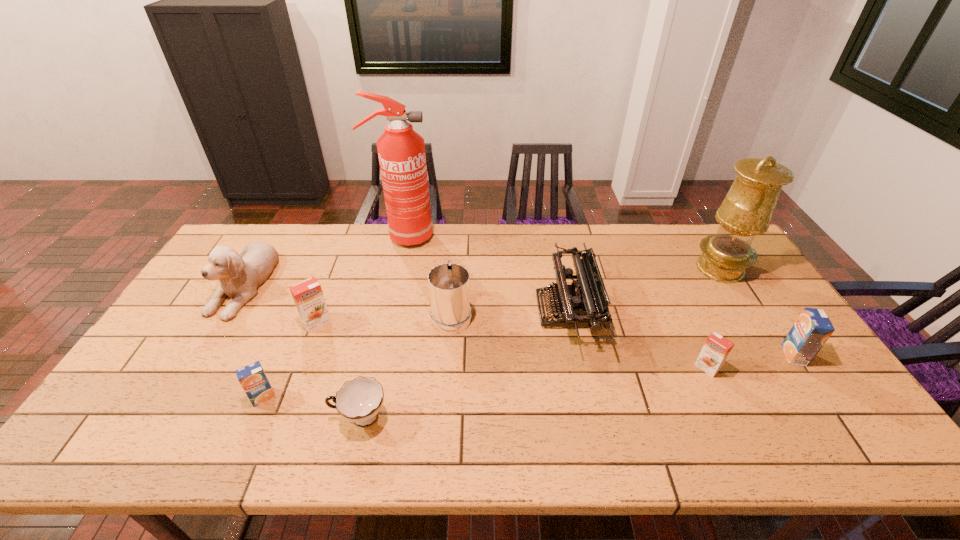
Locate an element on the screen. Image resolution: width=960 pixels, height=540 pixels. fire extinguisher is located at coordinates (401, 151).

Image resolution: width=960 pixels, height=540 pixels. I want to click on red fire extinguisher, so click(401, 151).

Where is `the ninth shortest object`? The width and height of the screenshot is (960, 540). the ninth shortest object is located at coordinates (746, 211).

The width and height of the screenshot is (960, 540). In order to click on white puppy in this screenshot , I will do `click(240, 275)`.

Identify the location of the leftmost object. This screenshot has height=540, width=960. (240, 275).

Image resolution: width=960 pixels, height=540 pixels. Identify the location of mug. (449, 288).

The image size is (960, 540). Identify the location of the fifth object from right to left. (449, 288).

Find the location of a particular element. The image size is (960, 540). the left orange orange juice is located at coordinates (308, 296).

Identify the location of the bigger orange orange juice. (308, 296).

The height and width of the screenshot is (540, 960). In order to click on the rightmost orange_juice in this screenshot , I will do [812, 329].